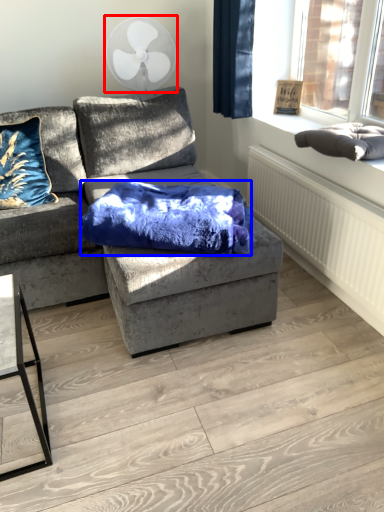
Question: Among these objects, which one is farthest to the camera, mechanical fan (highlighted by a red box) or blanket (highlighted by a blue box)?

Choices:
 (A) mechanical fan
 (B) blanket

Answer: (A)